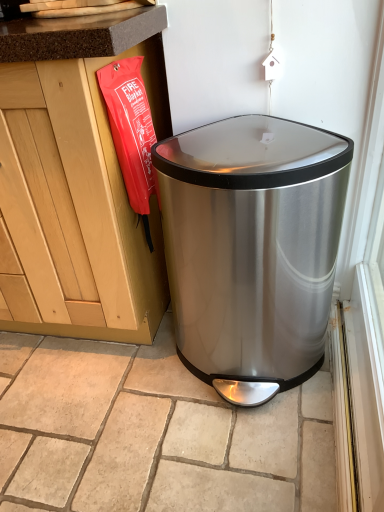
Question: Considering the positions of beige stone tile at center and stainless steel trash can at lower right in the image, is beige stone tile at center taller or shorter than stainless steel trash can at lower right?

Choices:
 (A) short
 (B) tall

Answer: (A)

Question: In the image, is beige stone tile at center positioned in front of or behind stainless steel trash can at lower right?

Choices:
 (A) front
 (B) behind

Answer: (B)

Question: Would you say beige stone tile at center is inside or outside stainless steel trash can at lower right?

Choices:
 (A) outside
 (B) inside

Answer: (A)

Question: From the image's perspective, relative to beige stone tile at center, is stainless steel trash can at lower right above or below?

Choices:
 (A) above
 (B) below

Answer: (A)

Question: Considering the positions of stainless steel trash can at lower right and beige stone tile at center in the image, is stainless steel trash can at lower right wider or thinner than beige stone tile at center?

Choices:
 (A) thin
 (B) wide

Answer: (A)

Question: In the image, is stainless steel trash can at lower right positioned in front of or behind beige stone tile at center?

Choices:
 (A) behind
 (B) front

Answer: (B)

Question: Is stainless steel trash can at lower right inside or outside of beige stone tile at center?

Choices:
 (A) inside
 (B) outside

Answer: (B)